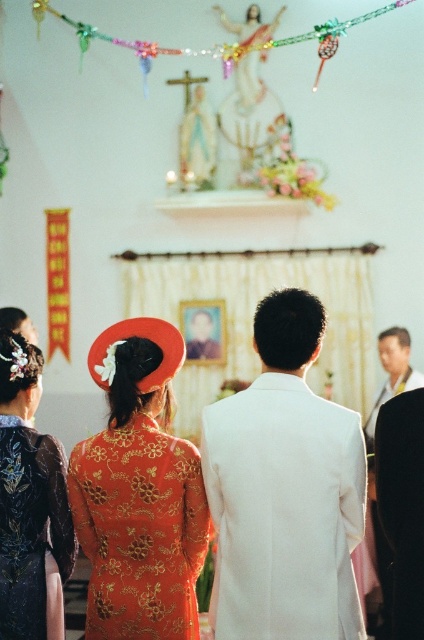
You are standing at the entrance of the church and want to take a photo of the point at coordinates point (293, 468). Given that the distance from you to that point is 139.84 feet, can you estimate if you can capture the entire scene in one shot without moving closer?

The distance between you and the point (293, 468) is 139.84 feet. Whether you can capture the entire scene depends on your camera lens. A standard lens might struggle at this distance, but a wide angle or telephoto lens could help. However, without knowing the camera specifications, it is hard to say for certain.

You are standing in a church and want to take a photo of the altar. There is a point at coordinates point (259, 301) in the scene. If you need to be at least 40 meters away to capture the entire altar in one shot, will you be able to do so from your current position?

The distance of point (259, 301) from viewer is 46.62 meters, which is more than the required 40 meters. Therefore, you can capture the entire altar in one shot from your current position.

You are a photographer setting up for a group photo at the wedding. You need to position the white matte suit at center and the shiny gold dress at center so that both fit comfortably in the frame. Which of the two should be placed closer to the center to ensure they both fit well?

The white matte suit at center has a larger width than the shiny gold dress at center, so placing the white matte suit at center closer to the center will allow both to fit comfortably in the frame.